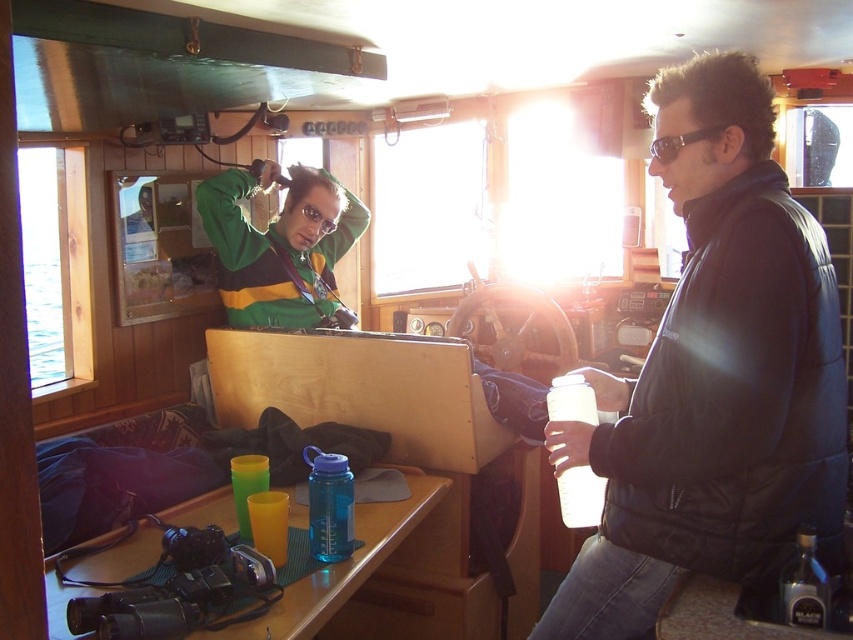
You are a passenger on the boat and want to place a small note on the table without covering any items. Given the green matte jacket at upper left and the blue plastic water bottle at lower left are on the table, where should you place the note?

Since the green matte jacket at upper left is taller than the blue plastic water bottle at lower left, placing the note on the side of the blue plastic water bottle at lower left would avoid covering taller items.

You are standing in the boat cabin and want to reach the point marked at coordinates point (614, 387). Can you safely stretch your arm to touch it without moving your feet?

The distance between you and the point (614, 387) is 1.65 meters. Since the average human arm length is about 0.7 meters, you cannot reach it without moving your feet.

Based on the photo, you are inside the boat cabin and want to reach a point closer to you. Which of the two points, point (674, 616) or point (654, 141), should you head towards?

Point (674, 616) is closer to the camera, so you should head towards point (674, 616).